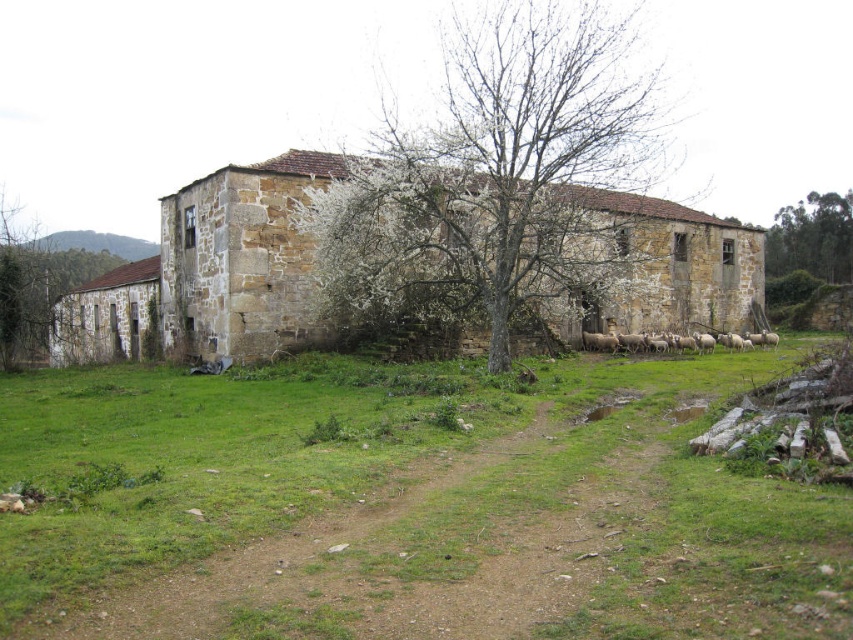
You are standing at the entrance of the old stone building and want to place a small garden ornament exactly at the location of the bare branches at center. What are the coordinates where you should place it?

The coordinates for placing the garden ornament at the location of the bare branches at center are at point [494,176].

You are a gardener planning to plant new flowers in the area between the green grass at center and the bare branches at center. Which area has more space available for planting?

The bare branches at center has more space available for planting since the green grass at center occupies less space than the bare branches at center.

From the picture: You are standing in front of the old stone building and want to walk to both point [534,161] and point [804,234]. Which point will you reach first?

You will reach point [534,161] first because it is closer to you than point [804,234].